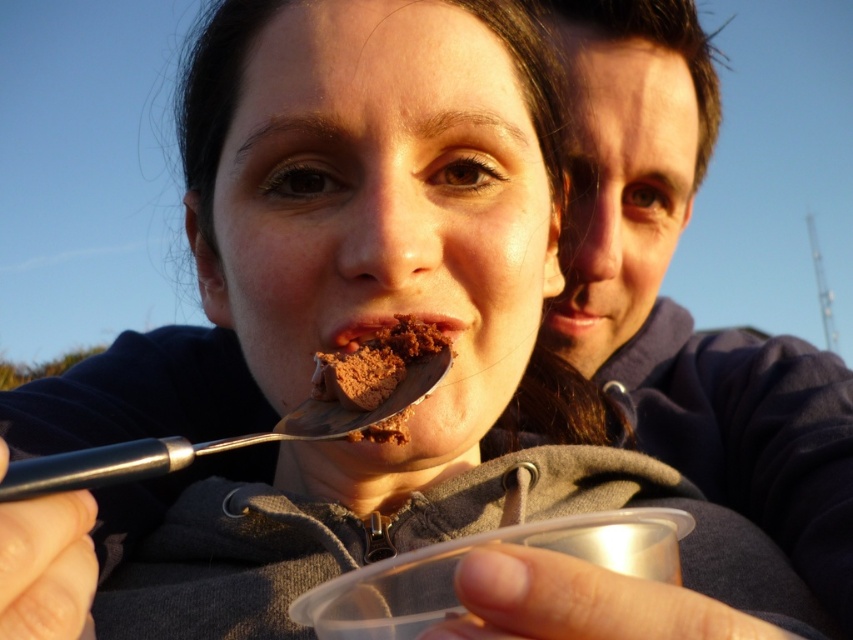
You are a photographer trying to capture the scene from the camera position. Which object is closer to the camera between the matte blue hoodie at upper right and the chocolate crumbly dessert at mouth?

The matte blue hoodie at upper right is closer to the camera than the chocolate crumbly dessert at mouth, as the dessert is positioned behind the hoodie.